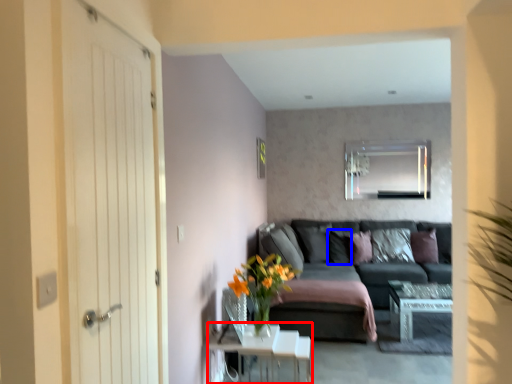
Question: Which of the following is the closest to the observer, table (highlighted by a red box) or pillow (highlighted by a blue box)?

Choices:
 (A) table
 (B) pillow

Answer: (A)